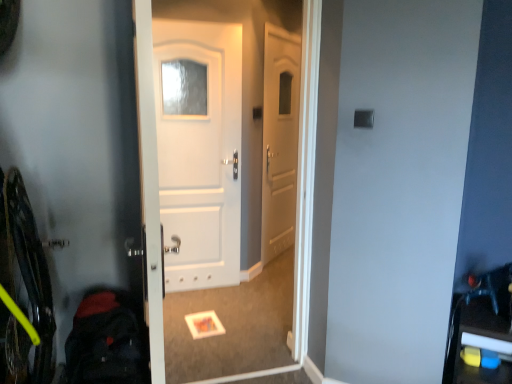
Identify the location of white matte door at center. This screenshot has width=512, height=384. (233, 326).

The width and height of the screenshot is (512, 384). What do you see at coordinates (233, 326) in the screenshot? I see `white matte door at center` at bounding box center [233, 326].

What is the approximate height of white matte door at center?

1.94 meters.

From the picture: Measure the distance between dark blue backpack at lower left and camera.

The depth of dark blue backpack at lower left is 4.25 feet.

The width and height of the screenshot is (512, 384). Describe the element at coordinates (106, 341) in the screenshot. I see `dark blue backpack at lower left` at that location.

Identify the location of dark blue backpack at lower left. (106, 341).

You are a GUI agent. You are given a task and a screenshot of the screen. Output one action in this format:
    pyautogui.click(x=<x>, y=<y>)
    Task: Click on the white matte door at center
    This screenshot has height=384, width=512.
    Given the screenshot: What is the action you would take?
    pyautogui.click(x=233, y=326)

Based on the photo, in the image, is white matte door at center on the left side or the right side of dark blue backpack at lower left?

white matte door at center is to the right of dark blue backpack at lower left.

Which object is closer to the camera, white matte door at center or dark blue backpack at lower left?

dark blue backpack at lower left is closer to the camera.

Considering the positions of point (271, 299) and point (129, 299), is point (271, 299) closer or farther from the camera than point (129, 299)?

Point (271, 299) is positioned farther from the camera compared to point (129, 299).

From the image's perspective, between white matte door at center and dark blue backpack at lower left, who is located below?

dark blue backpack at lower left.

From a real-world perspective, who is located lower, white matte door at center or dark blue backpack at lower left?

dark blue backpack at lower left is physically lower.

Which object is thinner, white matte door at center or dark blue backpack at lower left?

With smaller width is white matte door at center.

From their relative heights in the image, would you say white matte door at center is taller or shorter than dark blue backpack at lower left?

Clearly, white matte door at center is taller compared to dark blue backpack at lower left.

Based on their sizes in the image, would you say white matte door at center is bigger or smaller than dark blue backpack at lower left?

Clearly, white matte door at center is larger in size than dark blue backpack at lower left.

Is dark blue backpack at lower left a part of white matte door at center?

Definitely not — dark blue backpack at lower left is not inside white matte door at center.

Is white matte door at center next to dark blue backpack at lower left and touching it?

No, white matte door at center is not in contact with dark blue backpack at lower left.

Does white matte door at center turn towards dark blue backpack at lower left?

No, white matte door at center is not oriented towards dark blue backpack at lower left.

Can you tell me how much white matte door at center and dark blue backpack at lower left differ in facing direction?

The angular difference between white matte door at center and dark blue backpack at lower left is 0.516 degrees.

Find the location of a particular element. The image size is (512, 384). the back located underneath the white matte door at center (from a real-world perspective) is located at coordinates (106, 341).

Based on their positions, is dark blue backpack at lower left located to the left or right of white matte door at center?

Based on their positions, dark blue backpack at lower left is located to the left of white matte door at center.

Which object is closer to the camera, dark blue backpack at lower left or white matte door at center?

Positioned in front is dark blue backpack at lower left.

Does point (116, 377) come closer to viewer compared to point (286, 284)?

That is True.

From the image's perspective, is dark blue backpack at lower left located beneath white matte door at center?

Yes, from the image's perspective, dark blue backpack at lower left is beneath white matte door at center.

From a real-world perspective, between dark blue backpack at lower left and white matte door at center, who is vertically lower?

dark blue backpack at lower left is physically lower.

Which of these two, dark blue backpack at lower left or white matte door at center, is thinner?

white matte door at center.

Considering the relative sizes of dark blue backpack at lower left and white matte door at center in the image provided, is dark blue backpack at lower left shorter than white matte door at center?

Correct, dark blue backpack at lower left is not as tall as white matte door at center.

Which of these two, dark blue backpack at lower left or white matte door at center, is bigger?

white matte door at center is bigger.

Looking at this image, is dark blue backpack at lower left inside the boundaries of white matte door at center, or outside?

dark blue backpack at lower left is located beyond the bounds of white matte door at center.

Is dark blue backpack at lower left not near white matte door at center?

Absolutely, dark blue backpack at lower left is distant from white matte door at center.

Is white matte door at center at the back of dark blue backpack at lower left?

No, dark blue backpack at lower left's orientation is not away from white matte door at center.

How much distance is there between dark blue backpack at lower left and white matte door at center?

3.57 feet.

Locate an element on the screen. The image size is (512, 384). back that appears on the left of white matte door at center is located at coordinates (106, 341).

In order to click on back below the white matte door at center (from the image's perspective) in this screenshot , I will do [x=106, y=341].

Locate an element on the screen. screen door located behind the dark blue backpack at lower left is located at coordinates (233, 326).